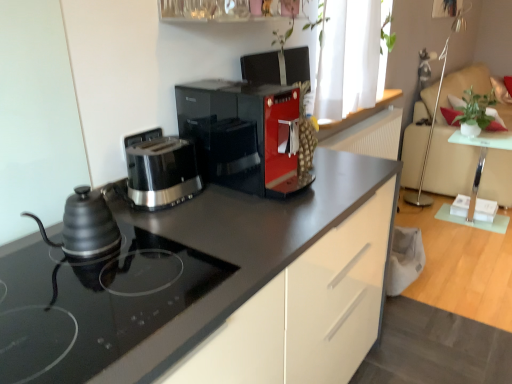
The image size is (512, 384). Find the location of `vacant area located to the right-hand side of matte black kettle at left`. vacant area located to the right-hand side of matte black kettle at left is located at coordinates (165, 263).